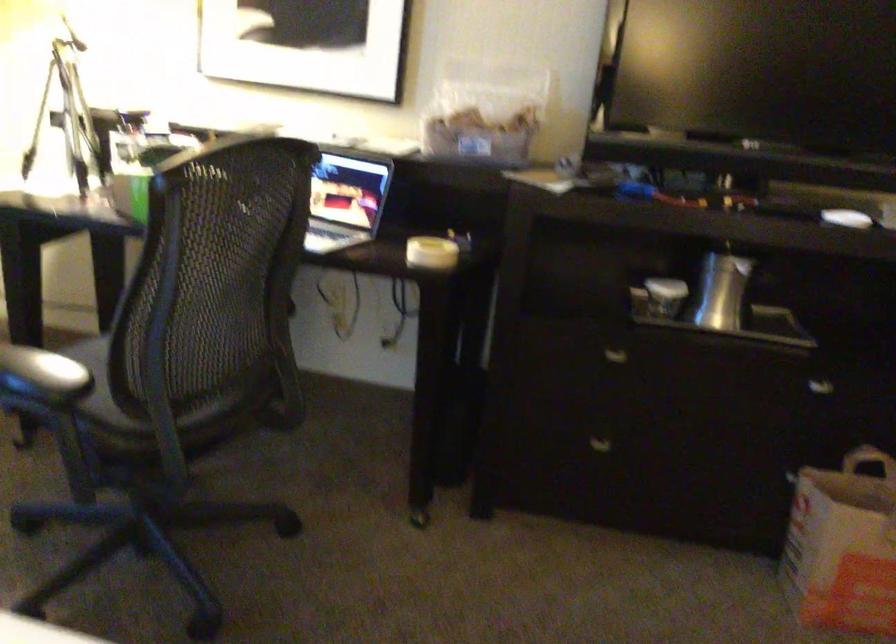
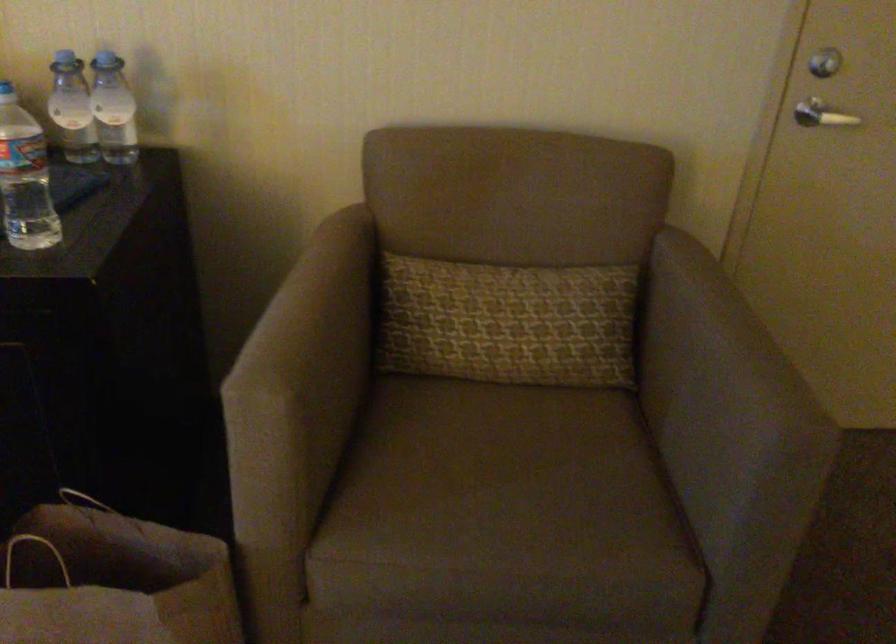
Question: In a continuous first-person perspective shot, in which direction is the camera moving?

Choices:
 (A) Left
 (B) Right
 (C) Forward
 (D) Backward

Answer: (B)